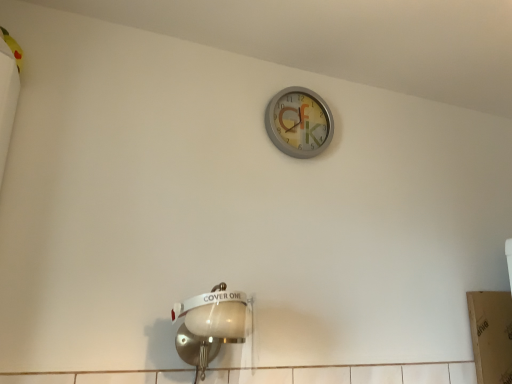
Question: Would you say metallic silver clock at upper center is inside or outside white glossy light fixture at lower left?

Choices:
 (A) inside
 (B) outside

Answer: (B)

Question: Considering the positions of metallic silver clock at upper center and white glossy light fixture at lower left in the image, is metallic silver clock at upper center taller or shorter than white glossy light fixture at lower left?

Choices:
 (A) short
 (B) tall

Answer: (A)

Question: Considering their positions, is metallic silver clock at upper center located in front of or behind white glossy light fixture at lower left?

Choices:
 (A) front
 (B) behind

Answer: (B)

Question: Choose the correct answer: Is white glossy light fixture at lower left inside metallic silver clock at upper center or outside it?

Choices:
 (A) outside
 (B) inside

Answer: (A)

Question: In terms of size, does white glossy light fixture at lower left appear bigger or smaller than metallic silver clock at upper center?

Choices:
 (A) small
 (B) big

Answer: (B)

Question: From a real-world perspective, is white glossy light fixture at lower left above or below metallic silver clock at upper center?

Choices:
 (A) above
 (B) below

Answer: (B)

Question: Visually, is white glossy light fixture at lower left positioned to the left or to the right of metallic silver clock at upper center?

Choices:
 (A) right
 (B) left

Answer: (B)